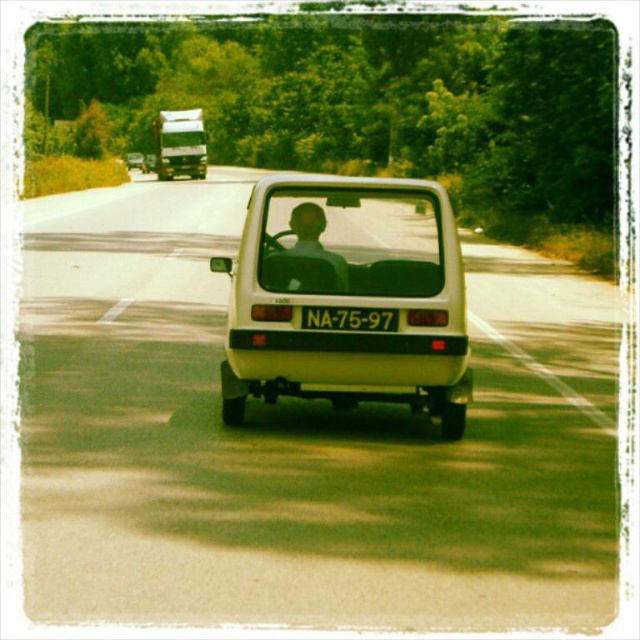
Is white matte van at center bigger than black plastic license plate at rear?

Yes, white matte van at center is bigger than black plastic license plate at rear.

Find the location of a particular element. The height and width of the screenshot is (640, 640). white matte van at center is located at coordinates (346, 298).

Between matte white truck at upper left and matte black shirt at rear, which one appears on the right side from the viewer's perspective?

Positioned to the right is matte black shirt at rear.

Can you confirm if matte white truck at upper left is positioned below matte black shirt at rear?

No, matte white truck at upper left is not below matte black shirt at rear.

Does point (195, 120) come behind point (340, 291)?

Yes, point (195, 120) is farther from viewer.

Identify the location of matte white truck at upper left. (179, 145).

Who is positioned more to the right, matte black shirt at rear or black plastic license plate at rear?

black plastic license plate at rear is more to the right.

From the picture: Between matte black shirt at rear and black plastic license plate at rear, which one has less height?

With less height is black plastic license plate at rear.

Is point (323, 257) closer to camera compared to point (365, 320)?

That is False.

Find the location of a particular element. The height and width of the screenshot is (640, 640). matte black shirt at rear is located at coordinates (314, 241).